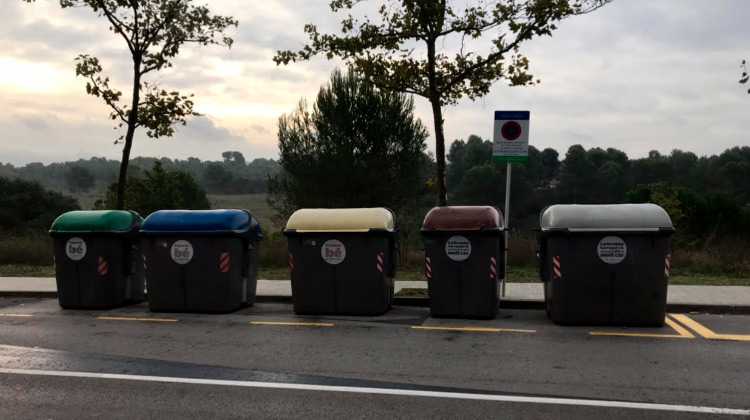
In order to click on trash bins in this screenshot , I will do `click(88, 260)`, `click(201, 259)`, `click(356, 265)`, `click(474, 265)`, `click(620, 262)`.